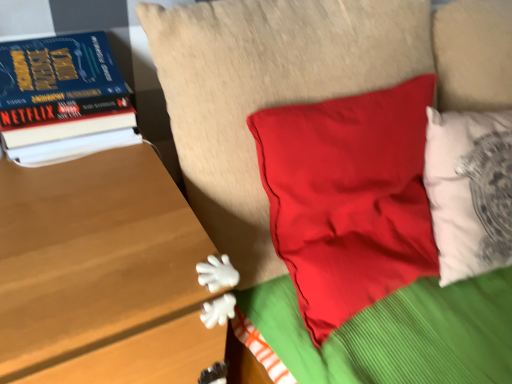
Question: Is matte red pillow at center completely or partially outside of wooden table at left?

Choices:
 (A) yes
 (B) no

Answer: (A)

Question: Is matte red pillow at center behind wooden table at left?

Choices:
 (A) yes
 (B) no

Answer: (A)

Question: Does matte red pillow at center have a greater width compared to wooden table at left?

Choices:
 (A) no
 (B) yes

Answer: (A)

Question: From the image's perspective, would you say matte red pillow at center is positioned over wooden table at left?

Choices:
 (A) no
 (B) yes

Answer: (B)

Question: Considering the relative sizes of matte red pillow at center and wooden table at left in the image provided, is matte red pillow at center shorter than wooden table at left?

Choices:
 (A) yes
 (B) no

Answer: (A)

Question: From the image's perspective, is matte red pillow at center below wooden table at left?

Choices:
 (A) no
 (B) yes

Answer: (A)

Question: Is hardcover book at left directly adjacent to wooden table at left?

Choices:
 (A) yes
 (B) no

Answer: (B)

Question: Is hardcover book at left surrounding wooden table at left?

Choices:
 (A) no
 (B) yes

Answer: (A)

Question: Can we say hardcover book at left lies outside wooden table at left?

Choices:
 (A) no
 (B) yes

Answer: (B)

Question: Is hardcover book at left at the right side of wooden table at left?

Choices:
 (A) yes
 (B) no

Answer: (A)

Question: Is the position of hardcover book at left more distant than that of wooden table at left?

Choices:
 (A) yes
 (B) no

Answer: (A)

Question: Considering the relative sizes of hardcover book at left and wooden table at left in the image provided, is hardcover book at left thinner than wooden table at left?

Choices:
 (A) no
 (B) yes

Answer: (B)

Question: Is wooden table at left thinner than matte red pillow at center?

Choices:
 (A) yes
 (B) no

Answer: (B)